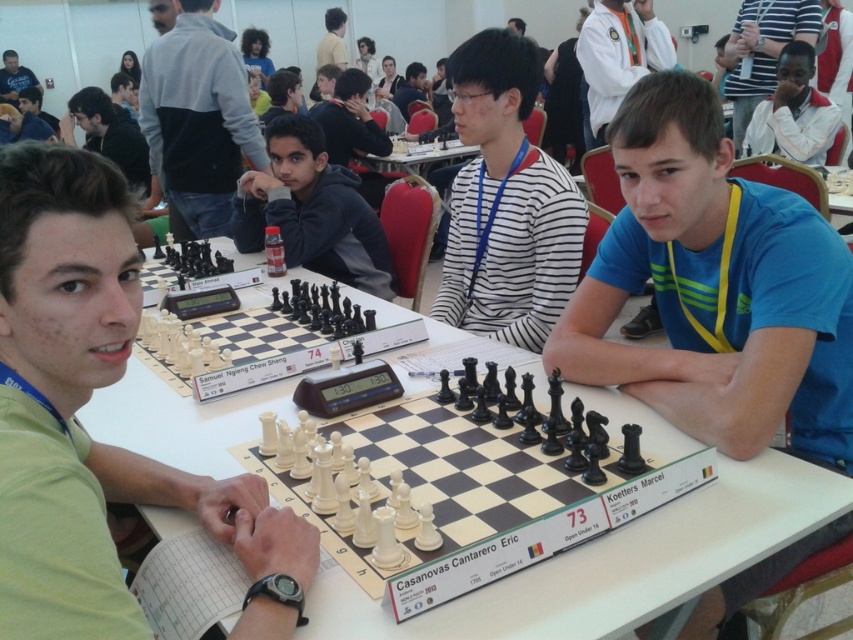
In the scene shown: Who is more distant from viewer, (579, 323) or (747, 516)?

Point (579, 323)

Can you confirm if blue cotton shirt at center is smaller than white plastic table at center?

Correct, blue cotton shirt at center occupies less space than white plastic table at center.

Locate an element on the screen. blue cotton shirt at center is located at coordinates (714, 289).

Can you confirm if white plastic table at center is shorter than matte black shirt at upper left?

Yes.

Can you confirm if white plastic table at center is thinner than matte black shirt at upper left?

No, white plastic table at center is not thinner than matte black shirt at upper left.

You are a GUI agent. You are given a task and a screenshot of the screen. Output one action in this format:
    pyautogui.click(x=<x>, y=<y>)
    Task: Click on the white plastic table at center
    This screenshot has width=853, height=640.
    Given the screenshot: What is the action you would take?
    pyautogui.click(x=616, y=564)

Identify the location of white plastic table at center. Image resolution: width=853 pixels, height=640 pixels. (616, 564).

Consider the image. Can you confirm if blue cotton shirt at center is taller than matte black chess set at center?

Correct, blue cotton shirt at center is much taller as matte black chess set at center.

Between blue cotton shirt at center and matte black chess set at center, which one is positioned lower?

blue cotton shirt at center is lower down.

This screenshot has height=640, width=853. I want to click on blue cotton shirt at center, so (x=714, y=289).